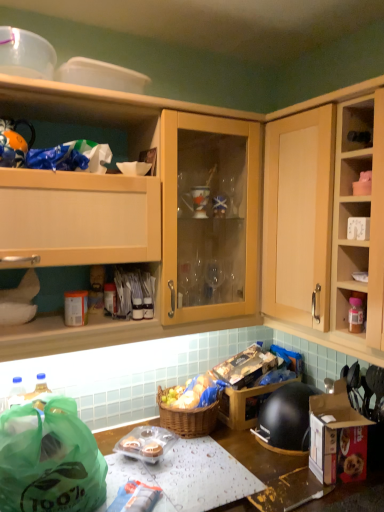
Question: Considering the relative sizes of cardboard box with dog food at lower right and wooden table at lower center in the image provided, is cardboard box with dog food at lower right bigger than wooden table at lower center?

Choices:
 (A) yes
 (B) no

Answer: (B)

Question: Can you confirm if cardboard box with dog food at lower right is thinner than wooden table at lower center?

Choices:
 (A) yes
 (B) no

Answer: (A)

Question: From a real-world perspective, is cardboard box with dog food at lower right on wooden table at lower center?

Choices:
 (A) yes
 (B) no

Answer: (A)

Question: Is wooden table at lower center at the back of cardboard box with dog food at lower right?

Choices:
 (A) no
 (B) yes

Answer: (A)

Question: Are cardboard box with dog food at lower right and wooden table at lower center making contact?

Choices:
 (A) yes
 (B) no

Answer: (B)

Question: Is the position of cardboard box with dog food at lower right more distant than that of wooden table at lower center?

Choices:
 (A) yes
 (B) no

Answer: (A)

Question: Can you confirm if matte plastic container at upper right is positioned to the right of green plastic bag at lower left?

Choices:
 (A) no
 (B) yes

Answer: (B)

Question: Can you confirm if matte plastic container at upper right is smaller than green plastic bag at lower left?

Choices:
 (A) no
 (B) yes

Answer: (B)

Question: Is matte plastic container at upper right placed right next to green plastic bag at lower left?

Choices:
 (A) yes
 (B) no

Answer: (B)

Question: Is matte plastic container at upper right facing away from green plastic bag at lower left?

Choices:
 (A) yes
 (B) no

Answer: (B)

Question: Is matte plastic container at upper right wider than green plastic bag at lower left?

Choices:
 (A) no
 (B) yes

Answer: (A)

Question: From a real-world perspective, is matte plastic container at upper right physically above green plastic bag at lower left?

Choices:
 (A) yes
 (B) no

Answer: (A)

Question: Is matte wood cabinet at upper left, the 2th cabinetry when ordered from right to left, shorter than matte plastic container at upper right?

Choices:
 (A) yes
 (B) no

Answer: (B)